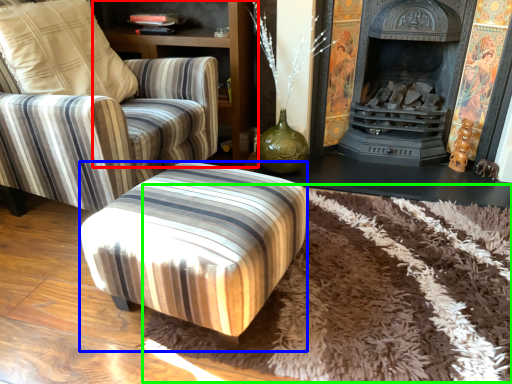
Question: Which is farther away from dresser (highlighted by a red box)? stool (highlighted by a blue box) or mat (highlighted by a green box)?

Choices:
 (A) stool
 (B) mat

Answer: (B)